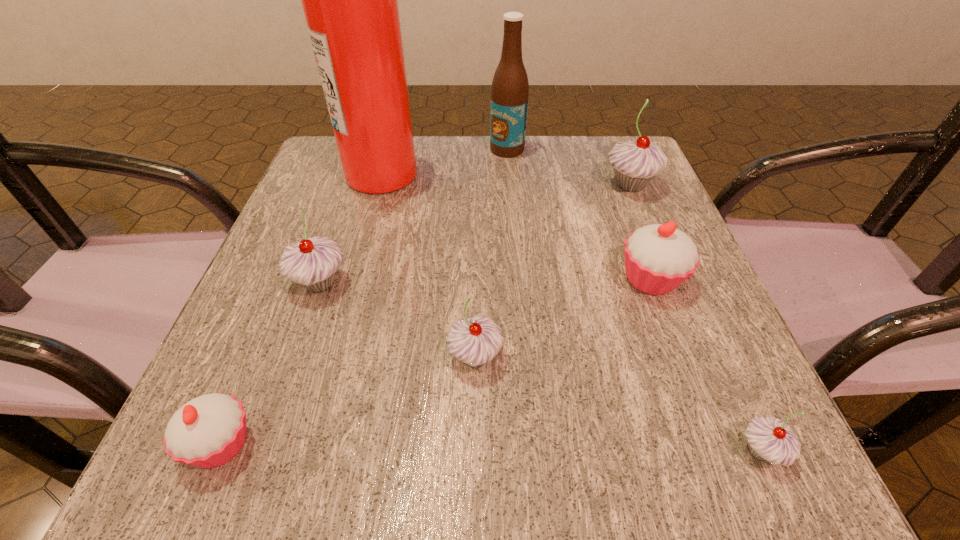
In the image, there is a desktop. Where is `vacant space at the near edge`? The image size is (960, 540). vacant space at the near edge is located at coordinates (520, 418).

Find the location of a particular element. The image size is (960, 540). vacant point at the left edge is located at coordinates (280, 331).

Locate an element on the screen. The height and width of the screenshot is (540, 960). vacant area at the right edge is located at coordinates (593, 213).

In order to click on vacant space at the far right corner of the desktop in this screenshot , I will do `click(593, 152)`.

In the image, there is a desktop. At what (x,y) coordinates should I click in order to perform the action: click on free space at the near right corner. Please return your answer as a coordinate pair (x, y). The width and height of the screenshot is (960, 540). Looking at the image, I should click on (x=657, y=451).

Identify the location of vacant space in between the nearer pink cupcake and the seventh shortest object. This screenshot has width=960, height=540. (365, 296).

You are a GUI agent. You are given a task and a screenshot of the screen. Output one action in this format:
    pyautogui.click(x=<x>, y=<y>)
    Task: Click on the vacant area that lies between the nearest gray cupcake and the second smallest gray cupcake
    
    Given the screenshot: What is the action you would take?
    pyautogui.click(x=618, y=404)

The height and width of the screenshot is (540, 960). I want to click on free spot between the nearest gray cupcake and the second tallest cupcake, so click(540, 367).

Where is `free space between the third tallest object and the second farthest gray cupcake`? Image resolution: width=960 pixels, height=540 pixels. free space between the third tallest object and the second farthest gray cupcake is located at coordinates (475, 234).

The width and height of the screenshot is (960, 540). What are the coordinates of `free space that is in between the leftmost gray cupcake and the beer bottle` in the screenshot? It's located at click(x=414, y=216).